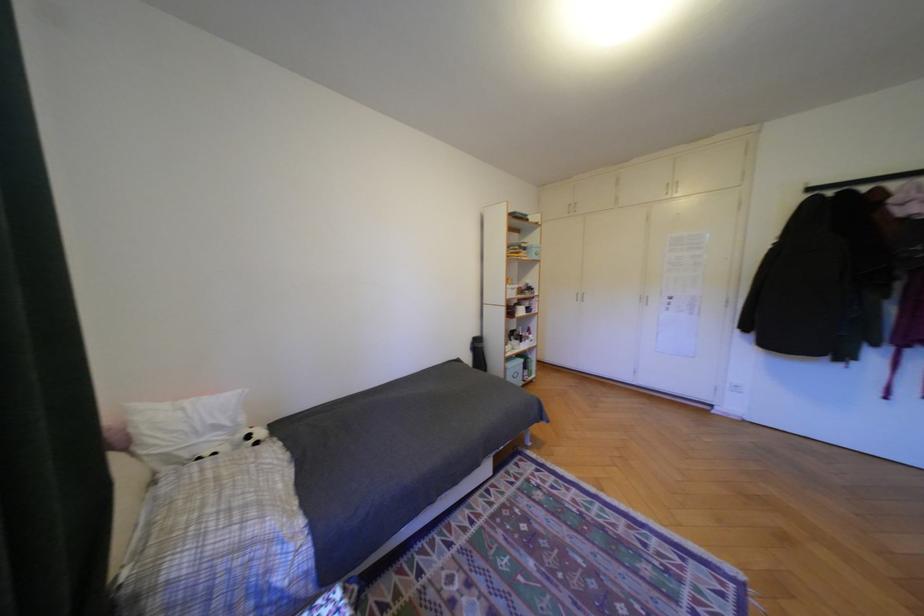
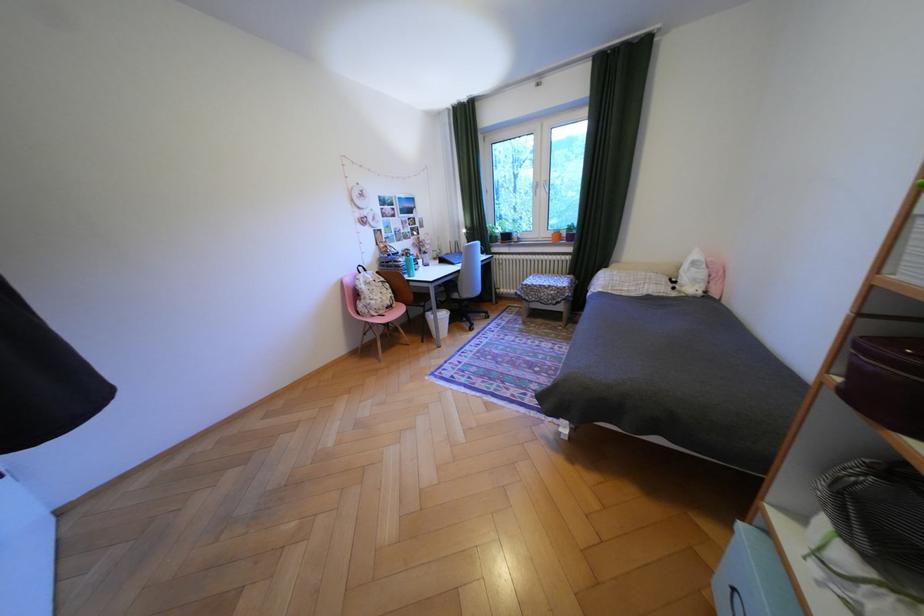
Locate, in the second image, the point that corresponds to point (261, 437) in the first image.

(687, 282)